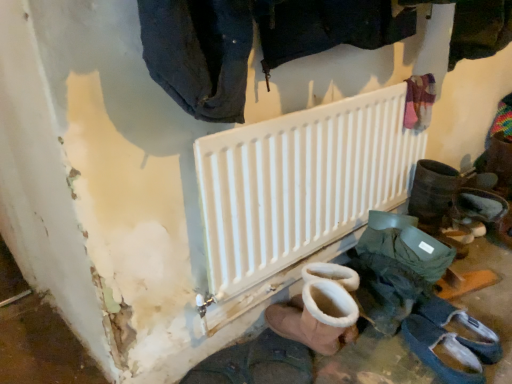
Question: From the image's perspective, is dark blue denim jeans at upper center on white matte radiator at center?

Choices:
 (A) yes
 (B) no

Answer: (A)

Question: Could you tell me if dark blue denim jeans at upper center is facing white matte radiator at center?

Choices:
 (A) no
 (B) yes

Answer: (A)

Question: Is dark blue denim jeans at upper center positioned with its back to white matte radiator at center?

Choices:
 (A) yes
 (B) no

Answer: (B)

Question: Is dark blue denim jeans at upper center wider than white matte radiator at center?

Choices:
 (A) yes
 (B) no

Answer: (A)

Question: From a real-world perspective, is dark blue denim jeans at upper center physically above white matte radiator at center?

Choices:
 (A) no
 (B) yes

Answer: (B)

Question: Is dark gray suede shoes at lower right, acting as the first footwear starting from the right, inside the boundaries of dark gray suede boot at lower right, which ranks as the fourth footwear in left-to-right order, or outside?

Choices:
 (A) outside
 (B) inside

Answer: (A)

Question: Considering the relative positions of dark gray suede shoes at lower right, acting as the first footwear starting from the right, and dark gray suede boot at lower right, which is counted as the 2th footwear, starting from the right, in the image provided, is dark gray suede shoes at lower right, acting as the first footwear starting from the right, to the left or to the right of dark gray suede boot at lower right, which is counted as the 2th footwear, starting from the right,?

Choices:
 (A) right
 (B) left

Answer: (A)

Question: Considering their positions, is dark gray suede shoes at lower right, acting as the first footwear starting from the right, located in front of or behind dark gray suede boot at lower right, which is counted as the 2th footwear, starting from the right?

Choices:
 (A) front
 (B) behind

Answer: (B)

Question: From a real-world perspective, is dark gray suede shoes at lower right, which is counted as the fifth footwear, starting from the left, positioned above or below dark gray suede boot at lower right, which ranks as the fourth footwear in left-to-right order?

Choices:
 (A) above
 (B) below

Answer: (A)

Question: Would you say white matte radiator at center is inside or outside brown suede boot at lower center, placed as the fourth footwear when sorted from right to left?

Choices:
 (A) outside
 (B) inside

Answer: (A)

Question: Is white matte radiator at center wider or thinner than brown suede boot at lower center, which is counted as the 2th footwear, starting from the left?

Choices:
 (A) wide
 (B) thin

Answer: (B)

Question: Visually, is white matte radiator at center positioned to the left or to the right of brown suede boot at lower center, placed as the fourth footwear when sorted from right to left?

Choices:
 (A) right
 (B) left

Answer: (A)

Question: From the image's perspective, relative to brown suede boot at lower center, which is counted as the 2th footwear, starting from the left, is white matte radiator at center above or below?

Choices:
 (A) above
 (B) below

Answer: (A)

Question: Considering the positions of brown suede boot at lower center, which is counted as the 2th footwear, starting from the left, and white suede boot at lower center, the 3th footwear viewed from the left, in the image, is brown suede boot at lower center, which is counted as the 2th footwear, starting from the left, bigger or smaller than white suede boot at lower center, the 3th footwear viewed from the left,?

Choices:
 (A) small
 (B) big

Answer: (A)

Question: Relative to white suede boot at lower center, which ranks as the 3th footwear in right-to-left order, is brown suede boot at lower center, which is counted as the 2th footwear, starting from the left, in front or behind?

Choices:
 (A) behind
 (B) front

Answer: (A)